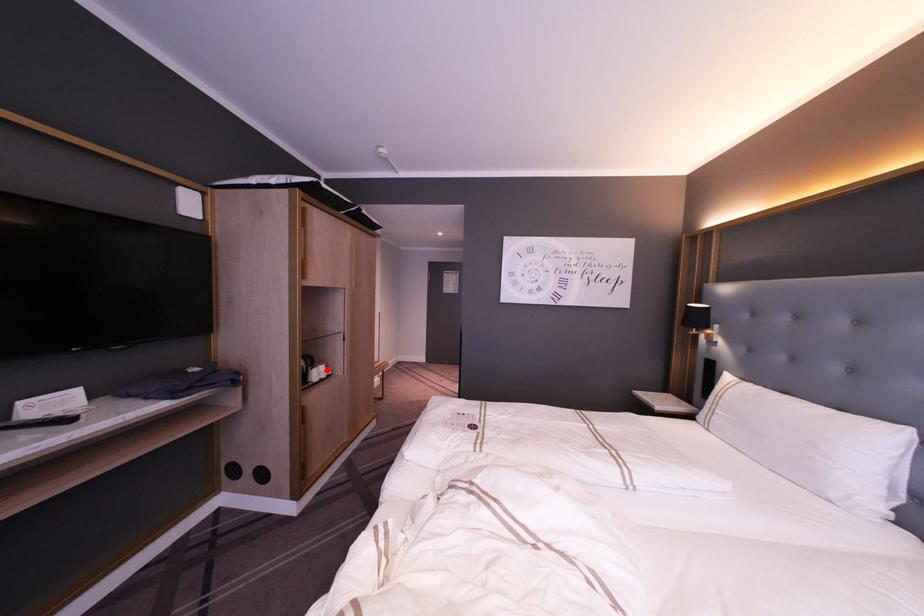
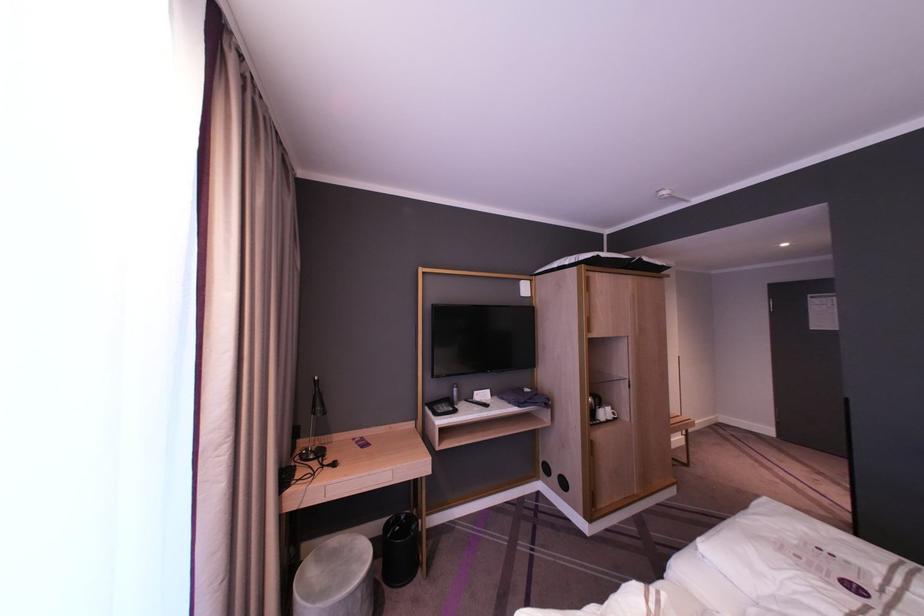
Question: I am providing you with two images of the same scene from different viewpoints. In image1, a red point is highlighted. Considering the same 3D point in image2, which of the following is correct?

Choices:
 (A) It is closer
 (B) It is farther

Answer: (B)